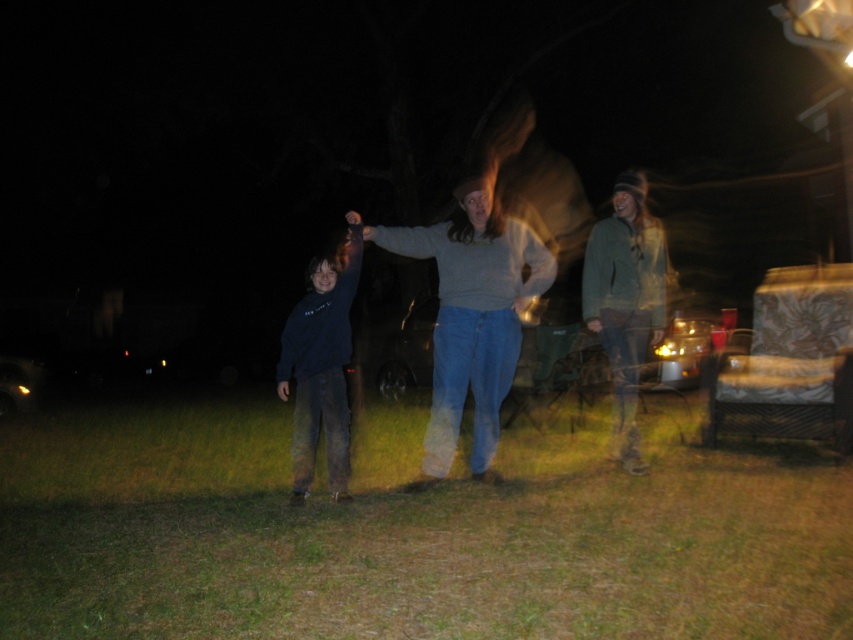
Between gray sweater at center and dark blue sweatshirt at center, which one is positioned higher?

gray sweater at center is higher up.

Can you confirm if gray sweater at center is bigger than dark blue sweatshirt at center?

Yes, gray sweater at center is bigger than dark blue sweatshirt at center.

Is point (505, 324) less distant than point (329, 456)?

Yes, point (505, 324) is in front of point (329, 456).

Locate an element on the screen. gray sweater at center is located at coordinates (473, 317).

Does green grass at lower center have a larger size compared to dark blue sweatshirt at center?

Yes.

Is green grass at lower center above dark blue sweatshirt at center?

Actually, green grass at lower center is below dark blue sweatshirt at center.

Between point (386, 520) and point (334, 301), which one is positioned in front?

Positioned in front is point (386, 520).

Identify the location of green grass at lower center. (410, 532).

Is gray sweater at center positioned in front of green textured jacket at center?

Yes.

Is gray sweater at center wider than green textured jacket at center?

Yes, gray sweater at center is wider than green textured jacket at center.

Who is more forward, [476,412] or [636,275]?

Point [476,412]

Identify the location of gray sweater at center. The image size is (853, 640). (473, 317).